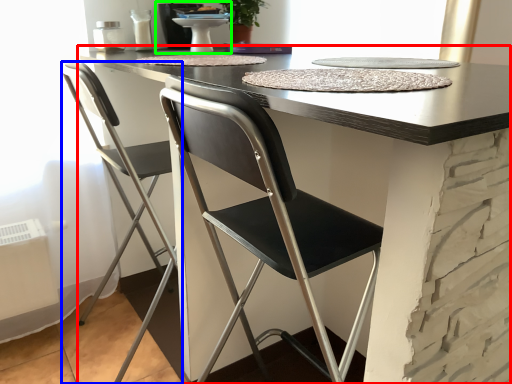
Question: Considering the real-world distances, which object is farthest from table (highlighted by a red box)? chair (highlighted by a blue box) or sink (highlighted by a green box)?

Choices:
 (A) chair
 (B) sink

Answer: (B)